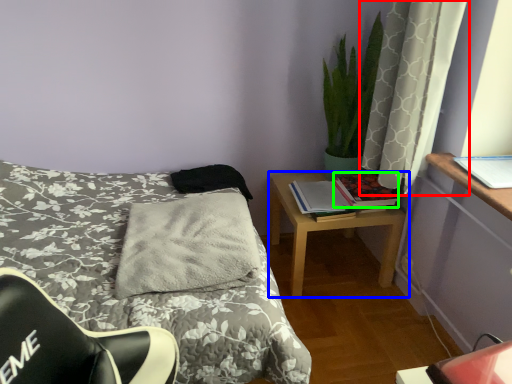
Question: Considering the real-world distances, which object is closest to curtain (highlighted by a red box)? nightstand (highlighted by a blue box) or book (highlighted by a green box).

Choices:
 (A) nightstand
 (B) book

Answer: (B)